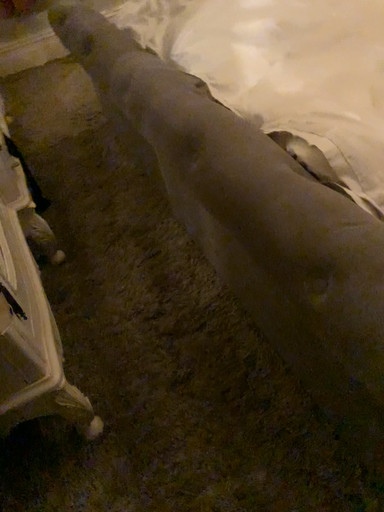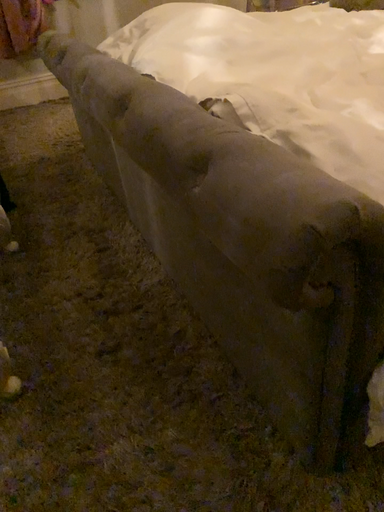
Question: How did the camera likely rotate when shooting the video?

Choices:
 (A) rotated downward
 (B) rotated upward

Answer: (B)